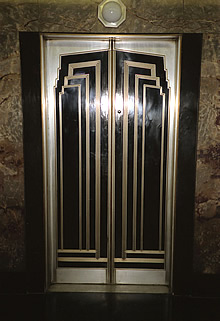
Where is `white round light`? white round light is located at coordinates (111, 15).